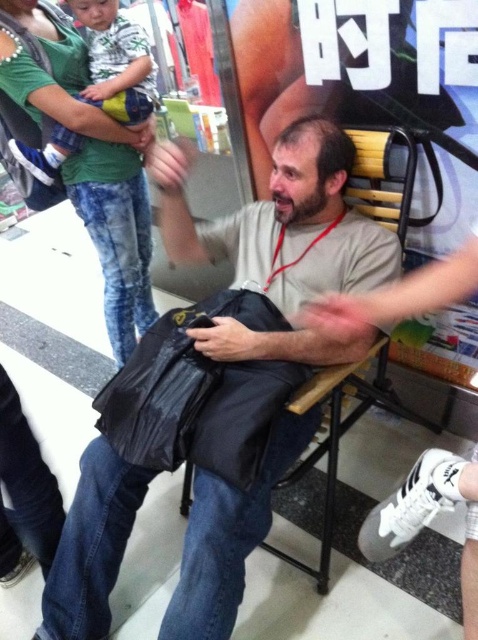
Consider the image. You are a security officer at the station and you see both the matte black bag at center and the black matte bag at center. Which one is closer to you?

The matte black bag at center is closer to you because it is in front of the black matte bag at center.